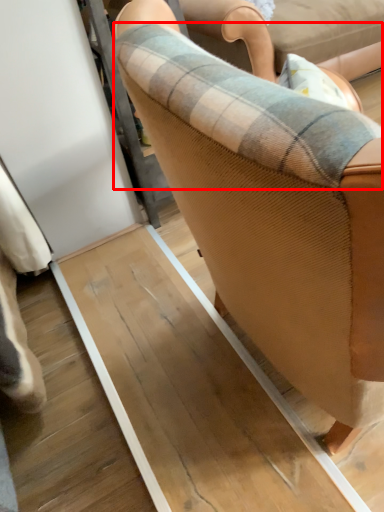
Question: From the image's perspective, where is plaid (annotated by the red box) located in relation to chair in the image?

Choices:
 (A) above
 (B) below

Answer: (A)